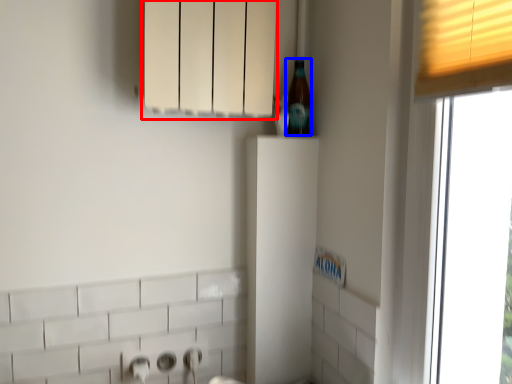
Question: Which of the following is the farthest to the observer, cabinetry (highlighted by a red box) or beer bottle (highlighted by a blue box)?

Choices:
 (A) cabinetry
 (B) beer bottle

Answer: (B)